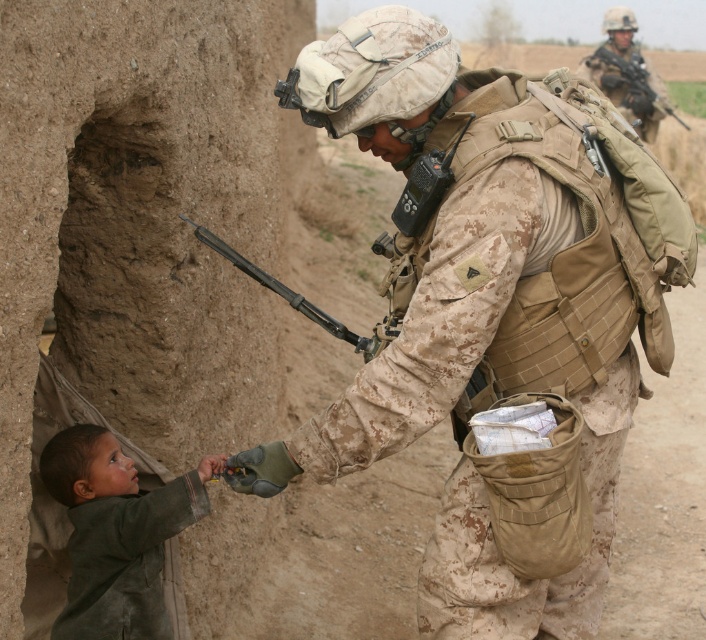
Can you confirm if camouflage uniform at center is shorter than camouflage uniform at upper right?

Yes, camouflage uniform at center is shorter than camouflage uniform at upper right.

Between point (493, 170) and point (647, 65), which one is positioned behind?

Positioned behind is point (647, 65).

Locate an element on the screen. camouflage uniform at center is located at coordinates (479, 312).

The image size is (706, 640). In order to click on camouflage uniform at center in this screenshot , I will do `click(479, 312)`.

Does camouflage uniform at center appear under dark green fabric at lower left?

No.

Which is more to the right, camouflage uniform at center or dark green fabric at lower left?

camouflage uniform at center

Describe the element at coordinates (479, 312) in the screenshot. I see `camouflage uniform at center` at that location.

At what (x,y) coordinates should I click in order to perform the action: click on camouflage uniform at center. Please return your answer as a coordinate pair (x, y). Image resolution: width=706 pixels, height=640 pixels. Looking at the image, I should click on (479, 312).

Does dark green fabric at lower left have a lesser width compared to camouflage uniform at upper right?

Indeed, dark green fabric at lower left has a lesser width compared to camouflage uniform at upper right.

Is dark green fabric at lower left taller than camouflage uniform at upper right?

No.

This screenshot has width=706, height=640. I want to click on dark green fabric at lower left, so (116, 532).